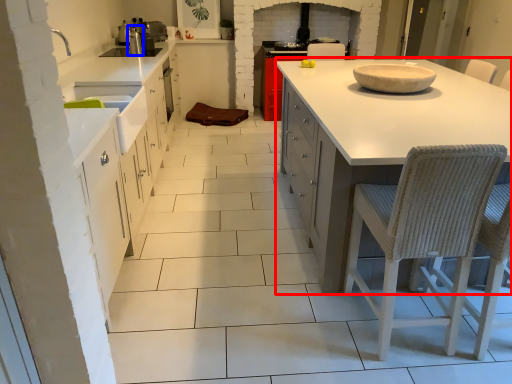
Question: Which object is further to the camera taking this photo, countertop (highlighted by a red box) or appliance (highlighted by a blue box)?

Choices:
 (A) countertop
 (B) appliance

Answer: (B)